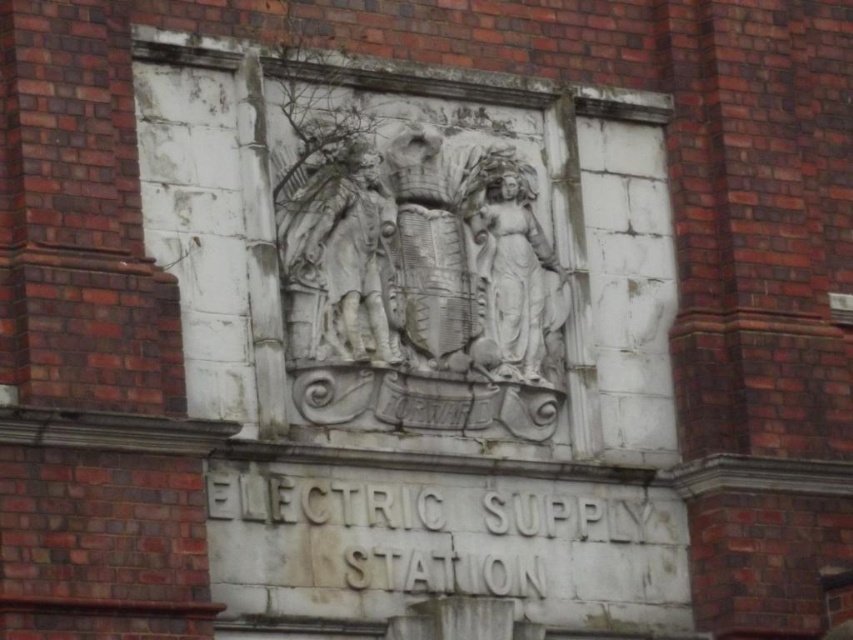
Can you confirm if white stone relief at center is positioned below white stone statue at center?

Yes.

From the picture: Does white stone relief at center have a greater width compared to white stone statue at center?

Incorrect, white stone relief at center's width does not surpass white stone statue at center's.

Find the location of a particular element. This screenshot has width=853, height=640. white stone relief at center is located at coordinates (339, 259).